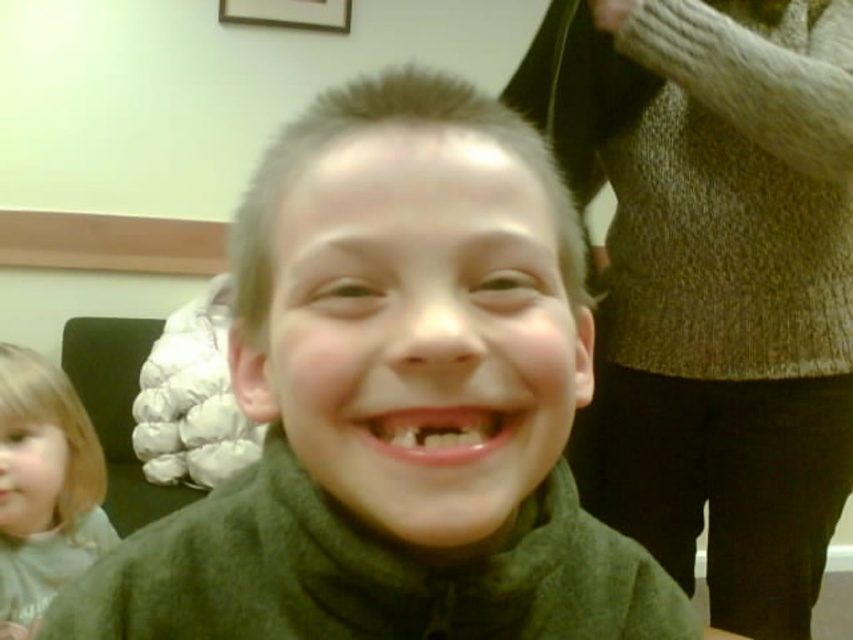
Looking at this image, you are standing in a room and see two points marked in the image. The first point is at coordinates point (473,144) and the second is at point (268,244). Which point is nearer to you?

Point (473,144) is closer to the viewer than point (268,244).

You are standing in a room and see a point at coordinates (395, 403). According to the image, what object is located at that point?

The point at coordinates (395, 403) marks the green matte jacket at center.